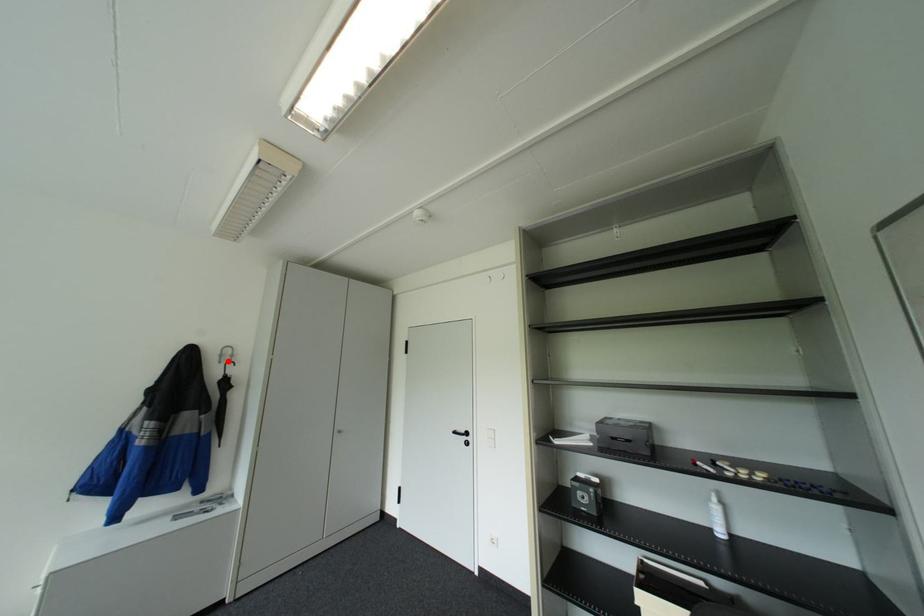
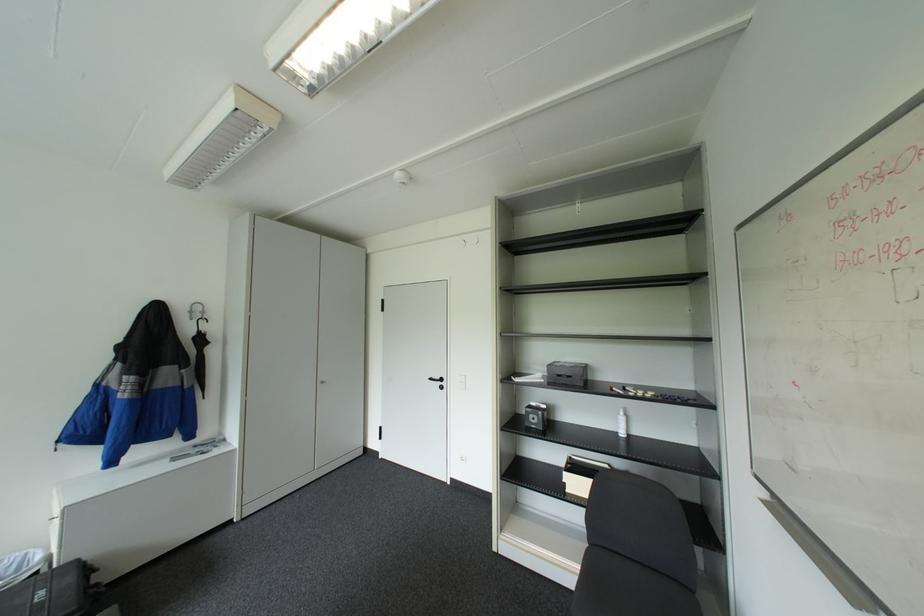
Find the pixel in the second image that matches the highlighted location in the first image.

(200, 318)